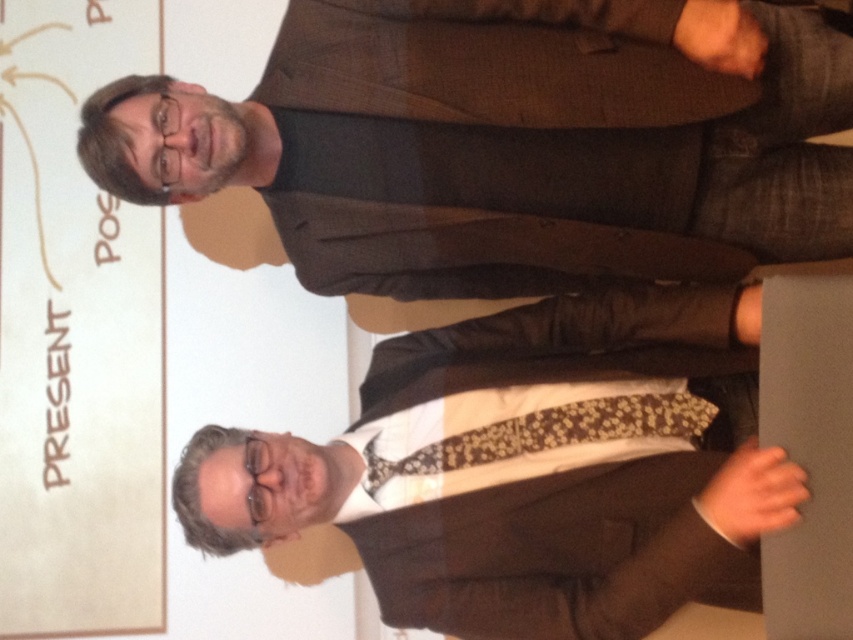
Question: Considering the relative positions of brown textured suit at upper center and floral-patterned fabric tie at center in the image provided, where is brown textured suit at upper center located with respect to floral-patterned fabric tie at center?

Choices:
 (A) right
 (B) left

Answer: (A)

Question: Which of the following is the closest to the observer?

Choices:
 (A) brown textured suit at upper center
 (B) brown textured suit at center
 (C) floral-patterned fabric tie at center

Answer: (B)

Question: Is brown textured suit at center to the left of floral-patterned fabric tie at center from the viewer's perspective?

Choices:
 (A) yes
 (B) no

Answer: (A)

Question: Which object appears farthest from the camera in this image?

Choices:
 (A) brown textured suit at upper center
 (B) brown textured suit at center

Answer: (A)

Question: Is brown textured suit at center smaller than floral-patterned fabric tie at center?

Choices:
 (A) yes
 (B) no

Answer: (B)

Question: Which point is closer to the camera?

Choices:
 (A) (514, 161)
 (B) (720, 419)

Answer: (A)